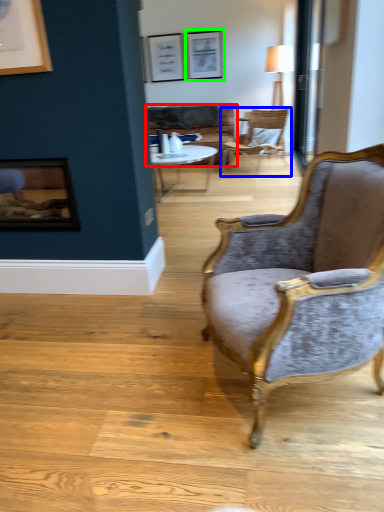
Question: Which is nearer to the studio couch (highlighted by a red box)? chair (highlighted by a blue box) or picture frame (highlighted by a green box).

Choices:
 (A) chair
 (B) picture frame

Answer: (A)